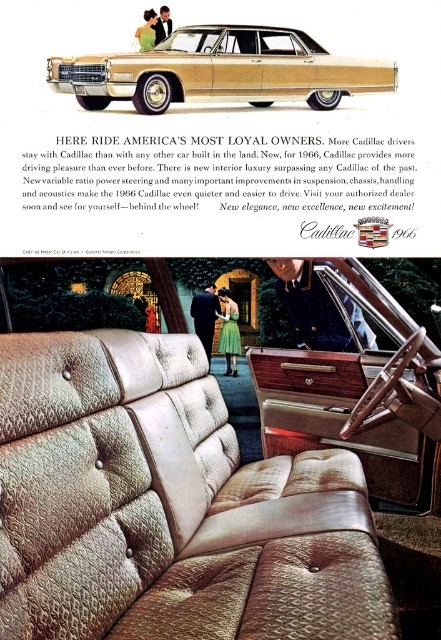
Which of these two, beige textured leather couch at center or gold textured car at center, stands taller?

beige textured leather couch at center is taller.

This screenshot has width=441, height=640. In order to click on beige textured leather couch at center in this screenshot , I will do `click(168, 506)`.

Can you confirm if beige textured leather couch at center is wider than beige textured leather interior at center?

A: Yes, beige textured leather couch at center is wider than beige textured leather interior at center.

Is beige textured leather couch at center shorter than beige textured leather interior at center?

Yes, beige textured leather couch at center is shorter than beige textured leather interior at center.

Find the location of a particular element. This screenshot has width=441, height=640. beige textured leather couch at center is located at coordinates (168, 506).

Does gold textured car at center come behind beige textured leather interior at center?

No, it is not.

Is gold textured car at center bigger than beige textured leather interior at center?

No, gold textured car at center is not bigger than beige textured leather interior at center.

What do you see at coordinates (220, 70) in the screenshot?
I see `gold textured car at center` at bounding box center [220, 70].

This screenshot has height=640, width=441. In order to click on gold textured car at center in this screenshot , I will do `click(220, 70)`.